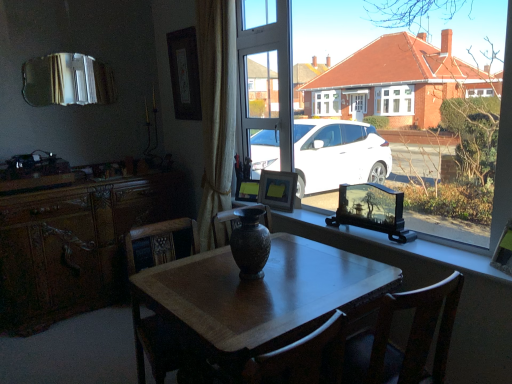
What do you see at coordinates (154, 345) in the screenshot?
I see `wooden chair at center` at bounding box center [154, 345].

In the scene shown: What is the approximate height of matte black vase at center?

It is 4.75 feet.

Identify the location of silver reflective mirror at upper left. This screenshot has height=384, width=512. (67, 81).

Is wooden desk at center completely or partially outside of matte black picture frame at center, which is the 3th picture frame in top-to-bottom order?

Yes, wooden desk at center is located beyond the bounds of matte black picture frame at center, which is the 3th picture frame in top-to-bottom order.

Is point (216, 291) positioned after point (249, 187)?

No, (216, 291) is closer to viewer.

In the scene shown: Is wooden desk at center oriented away from matte black picture frame at center, marked as the 3th picture frame in a front-to-back arrangement?

No, wooden desk at center's orientation is not away from matte black picture frame at center, marked as the 3th picture frame in a front-to-back arrangement.

Can you confirm if wooden desk at center is bigger than matte black picture frame at center, which is the 3th picture frame in top-to-bottom order?

Indeed, wooden desk at center has a larger size compared to matte black picture frame at center, which is the 3th picture frame in top-to-bottom order.

Is matte wooden picture frame at center, which appears as the third picture frame when viewed from the back, looking in the opposite direction of matte black picture frame at center, which is the 3th picture frame in top-to-bottom order?

No, matte black picture frame at center, which is the 3th picture frame in top-to-bottom order, is not at the back of matte wooden picture frame at center, which appears as the third picture frame when viewed from the back.

Considering the sizes of objects matte wooden picture frame at center, the 3th picture frame when ordered from bottom to top, and matte black picture frame at center, marked as the 3th picture frame in a front-to-back arrangement, in the image provided, who is smaller, matte wooden picture frame at center, the 3th picture frame when ordered from bottom to top, or matte black picture frame at center, marked as the 3th picture frame in a front-to-back arrangement,?

Smaller between the two is matte black picture frame at center, marked as the 3th picture frame in a front-to-back arrangement.

Which is correct: matte wooden picture frame at center, arranged as the second picture frame when viewed from the right, is inside matte black picture frame at center, placed as the third picture frame when sorted from right to left, or outside of it?

matte wooden picture frame at center, arranged as the second picture frame when viewed from the right, is not enclosed by matte black picture frame at center, placed as the third picture frame when sorted from right to left.

What's the angular difference between matte wooden picture frame at center, arranged as the 2th picture frame when viewed from the front, and matte black picture frame at center, which is the 3th picture frame in top-to-bottom order,'s facing directions?

12.7 degrees separate the facing orientations of matte wooden picture frame at center, arranged as the 2th picture frame when viewed from the front, and matte black picture frame at center, which is the 3th picture frame in top-to-bottom order.

From the image's perspective, is wooden desk at center beneath matte black vase at center?

Yes.

Does wooden desk at center appear on the left side of matte black vase at center?

Indeed, wooden desk at center is positioned on the left side of matte black vase at center.

Would you say wooden desk at center is inside or outside matte black vase at center?

wooden desk at center is not inside matte black vase at center, it's outside.

Is point (246, 350) closer to camera compared to point (502, 207)?

Yes, point (246, 350) is in front of point (502, 207).

Is matte black vase at center not close to matte black picture frame at upper center, the first picture frame viewed from the top?

Yes, matte black vase at center is far from matte black picture frame at upper center, the first picture frame viewed from the top.

In terms of height, does matte black vase at center look taller or shorter compared to matte black picture frame at upper center, the first picture frame viewed from the top?

matte black vase at center is taller than matte black picture frame at upper center, the first picture frame viewed from the top.

In the image, is matte black vase at center positioned in front of or behind matte black picture frame at upper center, the 1th picture frame from the back?

Clearly, matte black vase at center is in front of matte black picture frame at upper center, the 1th picture frame from the back.

Is point (347, 85) positioned after point (186, 69)?

No, it is not.

Does matte wooden picture frame at center, the 3th picture frame when ordered from bottom to top, come behind matte black vase at center?

Yes, matte wooden picture frame at center, the 3th picture frame when ordered from bottom to top, is behind matte black vase at center.

Between point (262, 199) and point (385, 143), which one is positioned behind?

The point (262, 199) is behind.

From their relative heights in the image, would you say matte wooden picture frame at center, which appears as the third picture frame when viewed from the back, is taller or shorter than matte black vase at center?

matte wooden picture frame at center, which appears as the third picture frame when viewed from the back, is shorter than matte black vase at center.

Between matte brown vase at center and silver reflective mirror at upper left, which one has smaller size?

Smaller between the two is matte brown vase at center.

From the image's perspective, who appears lower, matte brown vase at center or silver reflective mirror at upper left?

matte brown vase at center, from the image's perspective.

Is matte brown vase at center spatially inside silver reflective mirror at upper left, or outside of it?

matte brown vase at center is not inside silver reflective mirror at upper left, it's outside.

Can you confirm if matte wooden picture frame at center, the 3th picture frame when ordered from bottom to top, is positioned to the left of wooden desk at center?

No, matte wooden picture frame at center, the 3th picture frame when ordered from bottom to top, is not to the left of wooden desk at center.

You are a GUI agent. You are given a task and a screenshot of the screen. Output one action in this format:
    pyautogui.click(x=<x>, y=<y>)
    Task: Click on the 3rd picture frame positioned above the wooden desk at center (from the image's perspective)
    This screenshot has width=512, height=384.
    Given the screenshot: What is the action you would take?
    pyautogui.click(x=278, y=190)

Is matte wooden picture frame at center, arranged as the 2th picture frame when viewed from the front, spatially inside wooden desk at center, or outside of it?

matte wooden picture frame at center, arranged as the 2th picture frame when viewed from the front, exists outside the volume of wooden desk at center.

Is matte wooden picture frame at center, arranged as the second picture frame when viewed from the right, shorter than wooden desk at center?

Correct, matte wooden picture frame at center, arranged as the second picture frame when viewed from the right, is not as tall as wooden desk at center.

This screenshot has height=384, width=512. I want to click on desk that is on the right side of matte black picture frame at center, which is the 3th picture frame in top-to-bottom order, so pyautogui.click(x=259, y=296).

Where is `the 1st picture frame above the matte black picture frame at center, the second picture frame viewed from the back (from the image's perspective)`? The height and width of the screenshot is (384, 512). the 1st picture frame above the matte black picture frame at center, the second picture frame viewed from the back (from the image's perspective) is located at coordinates (278, 190).

When comparing their distances from matte black vase at center, does matte wooden picture frame at center, which appears as the third picture frame when viewed from the back, or wooden chair at center seem further?

wooden chair at center lies further to matte black vase at center than the other object.

From the picture: Which object lies nearer to the anchor point wooden picture frame at window, the 1th picture frame viewed from the right, matte wooden picture frame at center, arranged as the second picture frame when viewed from the right, or wooden chair at center?

matte wooden picture frame at center, arranged as the second picture frame when viewed from the right, is closer to wooden picture frame at window, the 1th picture frame viewed from the right.

From the image, which object appears to be farther from silver reflective mirror at upper left, wooden chair at center or matte black picture frame at center, marked as the 3th picture frame in a front-to-back arrangement?

Among the two, wooden chair at center is located further to silver reflective mirror at upper left.

Looking at the image, which one is located closer to silver reflective mirror at upper left, wooden picture frame at window, arranged as the 1th picture frame when ordered from the bottom, or matte brown vase at center?

matte brown vase at center lies closer to silver reflective mirror at upper left than the other object.

From the image, which object appears to be farther from wooden chair at center, matte brown vase at center or matte brown vase at center?

matte brown vase at center.

Based on their spatial positions, is wooden picture frame at window, which ranks as the first picture frame in front-to-back order, or wooden desk at center further from matte black picture frame at center, placed as the third picture frame when sorted from right to left?

wooden picture frame at window, which ranks as the first picture frame in front-to-back order, lies further to matte black picture frame at center, placed as the third picture frame when sorted from right to left, than the other object.

From the image, which object appears to be nearer to wooden chair at center, wooden picture frame at window, the 4th picture frame when ordered from left to right, or matte brown vase at center?

Based on the image, matte brown vase at center appears to be nearer to wooden chair at center.

From the image, which object appears to be farther from matte brown vase at center, silver reflective mirror at upper left or matte brown vase at center?

The object further to matte brown vase at center is silver reflective mirror at upper left.

This screenshot has width=512, height=384. Identify the location of cabinetry between wooden desk at center and matte black picture frame at upper center, the first picture frame viewed from the top, along the z-axis. (74, 246).

The width and height of the screenshot is (512, 384). Identify the location of vase located between matte brown vase at center and matte wooden picture frame at center, which appears as the 2th picture frame when viewed from the top, in the depth direction. (250, 243).

Find the location of a particular element. The height and width of the screenshot is (384, 512). cabinetry located between wooden chair at center and matte black picture frame at center, the second picture frame viewed from the back, in the depth direction is located at coordinates (74, 246).

I want to click on chair between silver reflective mirror at upper left and wooden picture frame at window, arranged as the 1th picture frame when ordered from the bottom, in the horizontal direction, so click(154, 345).